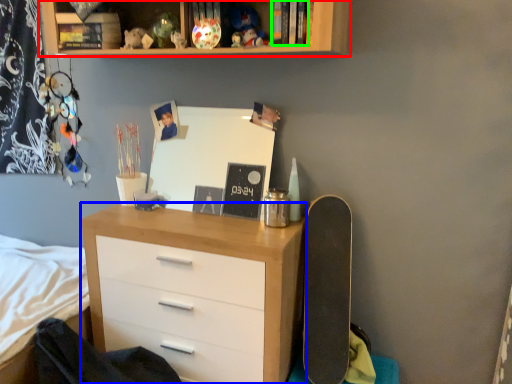
Question: Estimate the real-world distances between objects in this image. Which object is closer to shelf (highlighted by a red box), chest of drawers (highlighted by a blue box) or book (highlighted by a green box)?

Choices:
 (A) chest of drawers
 (B) book

Answer: (B)